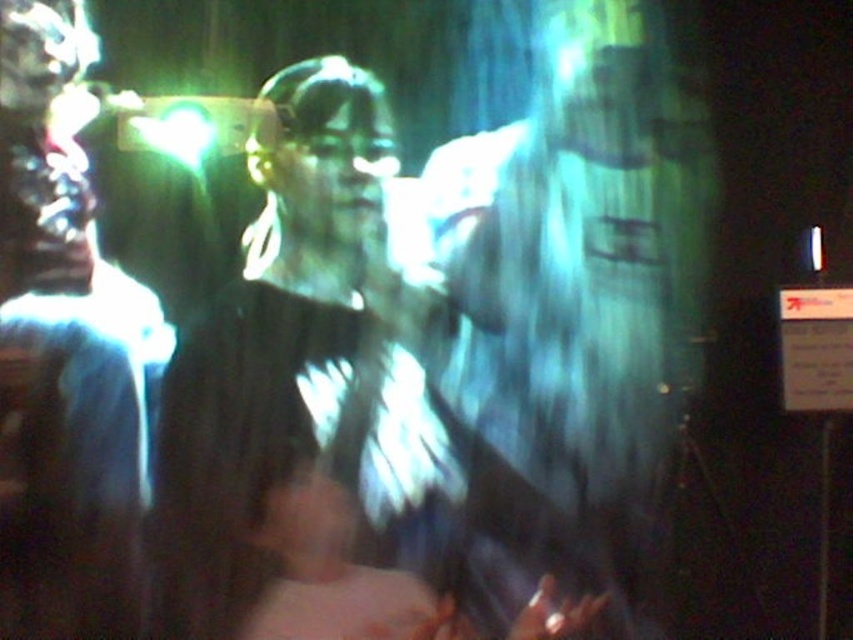
Who is shorter, translucent plastic bag at center or matte black jacket at center?

With less height is matte black jacket at center.

Is translucent plastic bag at center thinner than matte black jacket at center?

Incorrect, translucent plastic bag at center's width is not less than matte black jacket at center's.

In the scene shown: Who is more distant from viewer, [666,51] or [68,620]?

Positioned behind is point [666,51].

In order to click on translucent plastic bag at center in this screenshot , I will do `click(579, 317)`.

Can you confirm if translucent plastic bag at center is smaller than matte black shirt at center?

Indeed, translucent plastic bag at center has a smaller size compared to matte black shirt at center.

You are a GUI agent. You are given a task and a screenshot of the screen. Output one action in this format:
    pyautogui.click(x=<x>, y=<y>)
    Task: Click on the translucent plastic bag at center
    The height and width of the screenshot is (640, 853).
    Given the screenshot: What is the action you would take?
    pyautogui.click(x=579, y=317)

Which is in front, point (473, 438) or point (180, 552)?

Point (180, 552) is in front.

This screenshot has width=853, height=640. I want to click on translucent plastic bag at center, so click(579, 317).

Is point (209, 428) positioned in front of point (141, 340)?

That is False.

Which is below, matte black shirt at center or matte black jacket at center?

Positioned lower is matte black shirt at center.

Is point (396, 360) positioned after point (51, 180)?

Yes.

The width and height of the screenshot is (853, 640). What are the coordinates of `matte black shirt at center` in the screenshot? It's located at (305, 392).